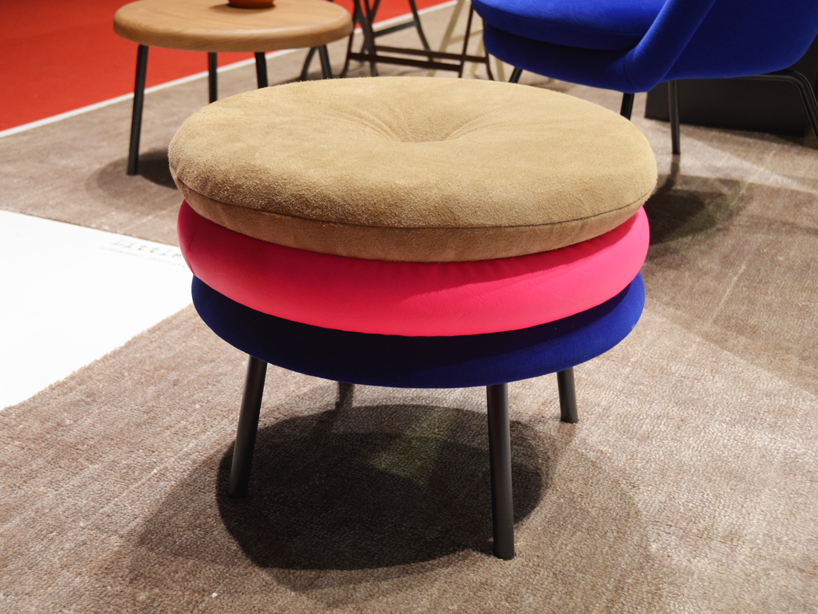
Locate an element on the screen. chair is located at coordinates (573, 17).